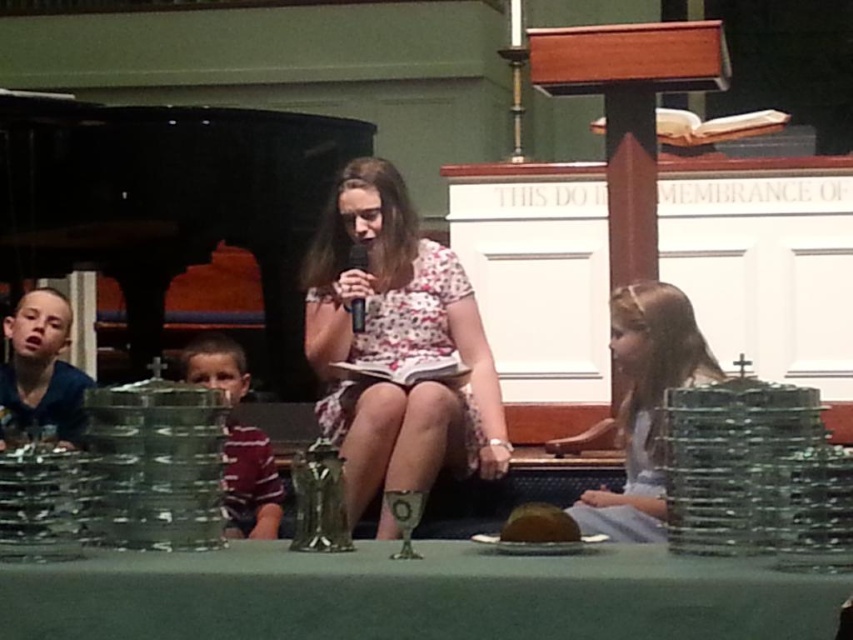
Which is below, green felt table at center or light blue fabric dress at center?

Positioned lower is green felt table at center.

Which is in front, point (608, 627) or point (621, 339)?

Point (608, 627) is in front.

Who is more distant from viewer, (x=740, y=566) or (x=631, y=464)?

Positioned behind is point (x=631, y=464).

Where is `green felt table at center`? green felt table at center is located at coordinates (415, 595).

Can you confirm if light blue fabric dress at center is shorter than striped fabric shirt at left?

In fact, light blue fabric dress at center may be taller than striped fabric shirt at left.

Is light blue fabric dress at center wider than striped fabric shirt at left?

Indeed, light blue fabric dress at center has a greater width compared to striped fabric shirt at left.

Where is `light blue fabric dress at center`? light blue fabric dress at center is located at coordinates (642, 406).

Locate an element on the screen. light blue fabric dress at center is located at coordinates (642, 406).

Is white floral dress at center shorter than blue cotton shirt at left?

In fact, white floral dress at center may be taller than blue cotton shirt at left.

Image resolution: width=853 pixels, height=640 pixels. Describe the element at coordinates (396, 344) in the screenshot. I see `white floral dress at center` at that location.

Between point (402, 449) and point (21, 428), which one is positioned in front?

Positioned in front is point (402, 449).

Where is `white floral dress at center`? The width and height of the screenshot is (853, 640). white floral dress at center is located at coordinates (396, 344).